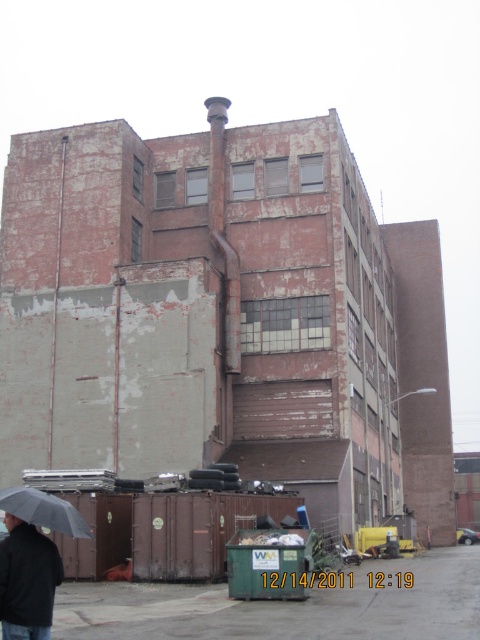
Question: Which of the following is the closest to the observer?

Choices:
 (A) matte black umbrella at lower left
 (B) black matte jacket at lower left

Answer: (B)

Question: Is black matte jacket at lower left to the left of matte black umbrella at lower left from the viewer's perspective?

Choices:
 (A) no
 (B) yes

Answer: (A)

Question: Observing the image, what is the correct spatial positioning of black matte jacket at lower left in reference to matte black umbrella at lower left?

Choices:
 (A) right
 (B) left

Answer: (A)

Question: Which object is closer to the camera taking this photo?

Choices:
 (A) matte black umbrella at lower left
 (B) black matte jacket at lower left

Answer: (B)

Question: Is black matte jacket at lower left bigger than matte black umbrella at lower left?

Choices:
 (A) no
 (B) yes

Answer: (A)